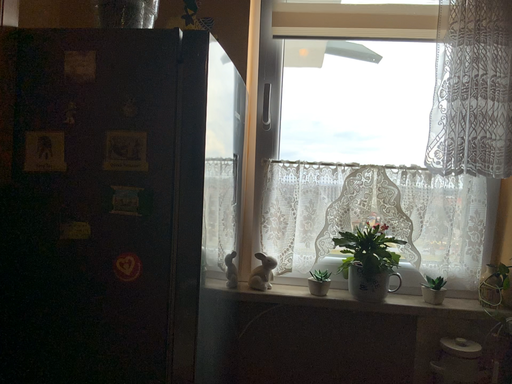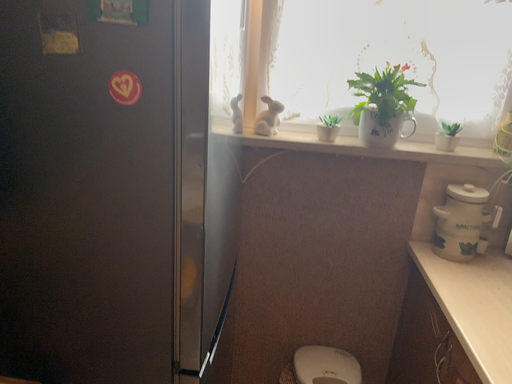
Question: Which way did the camera rotate in the video?

Choices:
 (A) rotated upward
 (B) rotated downward

Answer: (B)